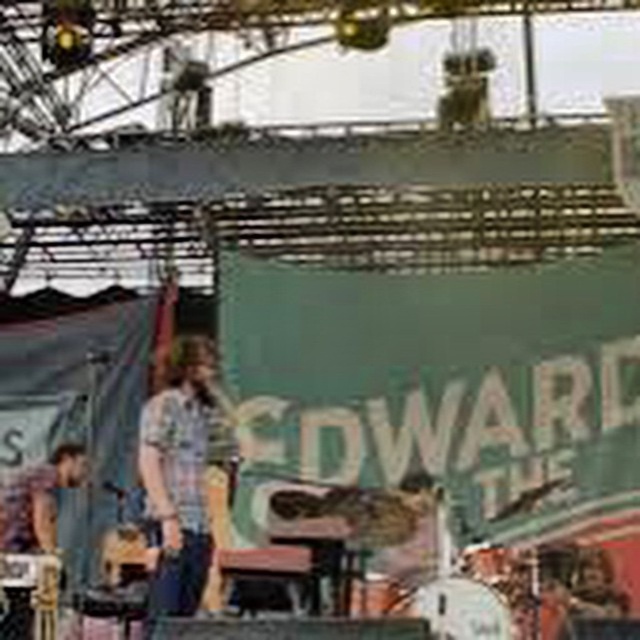
Question: Can you confirm if plaid shirt at center is wider than matte gray shirt at lower left?

Choices:
 (A) yes
 (B) no

Answer: (A)

Question: Is plaid shirt at center thinner than matte gray shirt at lower left?

Choices:
 (A) no
 (B) yes

Answer: (A)

Question: Which point is farther to the camera?

Choices:
 (A) (45, 618)
 (B) (163, 556)

Answer: (B)

Question: Is plaid shirt at center bigger than matte gray shirt at lower left?

Choices:
 (A) yes
 (B) no

Answer: (A)

Question: Among these objects, which one is nearest to the camera?

Choices:
 (A) plaid shirt at center
 (B) matte gray shirt at lower left

Answer: (B)

Question: Among these points, which one is nearest to the camera?

Choices:
 (A) (49, 589)
 (B) (148, 480)

Answer: (A)